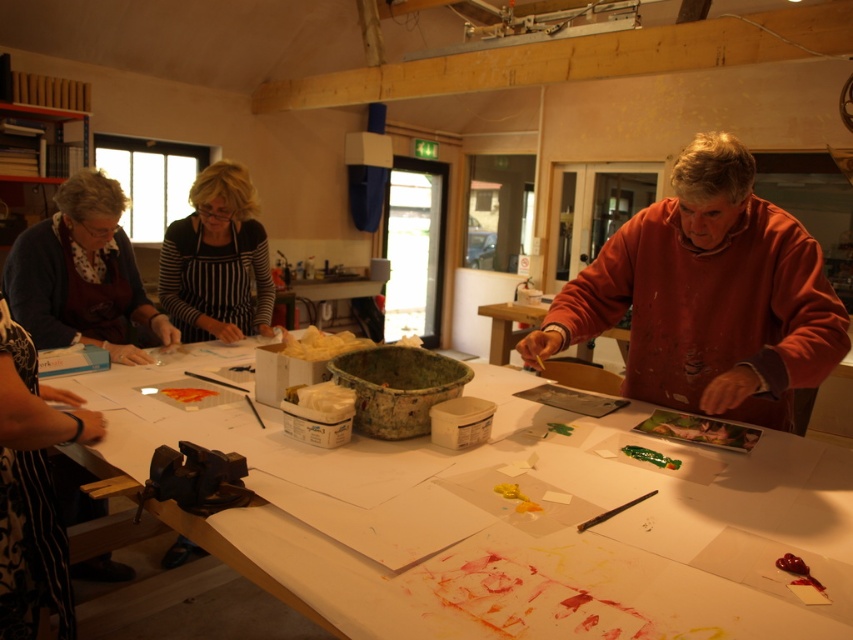
Is white paper at center positioned at the back of matte orange sweatshirt at right?

No, it is not.

Is white paper at center to the right of matte orange sweatshirt at right from the viewer's perspective?

In fact, white paper at center is to the left of matte orange sweatshirt at right.

Which is behind, point (340, 468) or point (682, 385)?

The point (682, 385) is more distant.

The width and height of the screenshot is (853, 640). I want to click on white paper at center, so click(500, 515).

Can you confirm if matte black apron at left is positioned above striped apron at center?

Yes, matte black apron at left is above striped apron at center.

Between point (128, 349) and point (257, 228), which one is positioned in front?

Point (128, 349) is more forward.

At what (x,y) coordinates should I click in order to perform the action: click on matte black apron at left. Please return your answer as a coordinate pair (x, y). The width and height of the screenshot is (853, 640). Looking at the image, I should click on (83, 276).

This screenshot has height=640, width=853. Describe the element at coordinates (706, 296) in the screenshot. I see `matte orange sweatshirt at right` at that location.

Locate an element on the screen. This screenshot has width=853, height=640. matte orange sweatshirt at right is located at coordinates (706, 296).

Image resolution: width=853 pixels, height=640 pixels. In order to click on matte orange sweatshirt at right in this screenshot , I will do `click(706, 296)`.